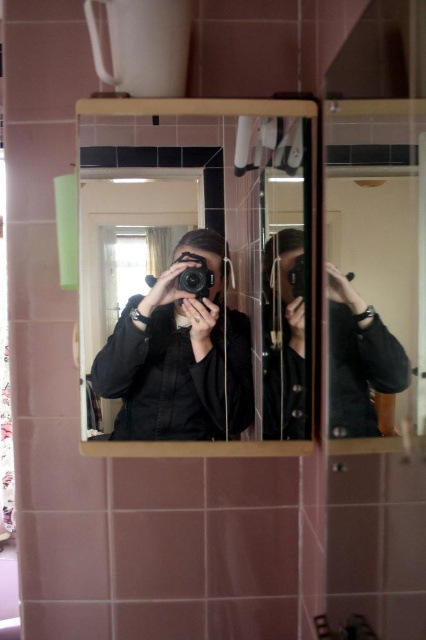
You are holding the black matte camera at center and want to take a photo of the reflection in the black glossy mirror at center. Since both are at the center, will the camera be able to capture the mirror clearly?

The black glossy mirror at center is closer to the viewer than the black matte camera at center, so the camera can capture the mirror clearly as it is positioned closer to the viewer.

You are holding the black matte camera at center and want to take a selfie using the reflection in the black glossy mirror at center. How far apart are the camera and the mirror?

The black glossy mirror at center and black matte camera at center are 4.08 inches apart from each other.

You are standing in the bathroom and want to place a small decoration between the two points labeled point (x=331, y=328) and point (x=284, y=320). Which point should the decoration be closer to in order to be nearer to you?

The decoration should be closer to point (x=331, y=328) because it is nearer to the viewer than point (x=284, y=320).